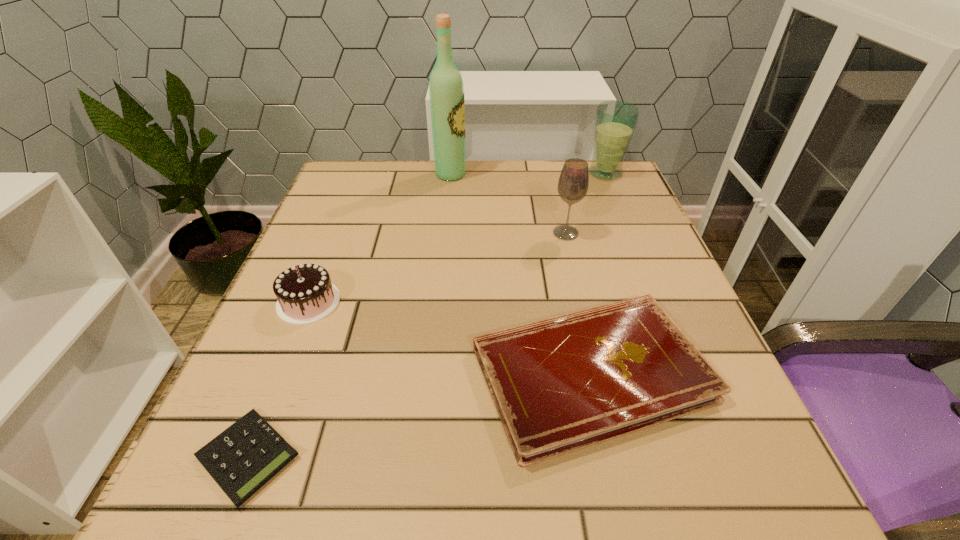
Find the location of a particular element. This screenshot has height=540, width=960. notebook located at the right edge is located at coordinates (565, 383).

Locate an element on the screen. object located in the near left corner section of the desktop is located at coordinates (244, 457).

You are a GUI agent. You are given a task and a screenshot of the screen. Output one action in this format:
    pyautogui.click(x=<x>, y=<y>)
    Task: Click on the object present at the far right corner
    
    Given the screenshot: What is the action you would take?
    pyautogui.click(x=615, y=121)

At what (x,y) coordinates should I click in order to perform the action: click on object present at the near right corner. Please return your answer as a coordinate pair (x, y). The image size is (960, 540). Looking at the image, I should click on [x=565, y=383].

At what (x,y) coordinates should I click in order to perform the action: click on blank space at the far edge of the desktop. Please return your answer as a coordinate pair (x, y). This screenshot has width=960, height=540. Looking at the image, I should click on (413, 164).

Identify the location of vacant space at the left edge of the desktop. (319, 392).

Where is `vacant space at the right edge`? vacant space at the right edge is located at coordinates (675, 436).

The width and height of the screenshot is (960, 540). I want to click on vacant space at the far left corner of the desktop, so click(390, 172).

You are a GUI agent. You are given a task and a screenshot of the screen. Output one action in this format:
    pyautogui.click(x=<x>, y=<y>)
    Task: Click on the vacant space at the far right corner of the desktop
    This screenshot has height=540, width=960.
    Given the screenshot: What is the action you would take?
    pyautogui.click(x=617, y=184)

Where is `vacant space that's between the right glass drink container and the second shortest object`? vacant space that's between the right glass drink container and the second shortest object is located at coordinates (598, 273).